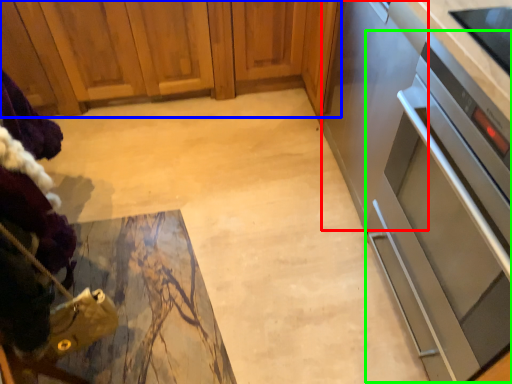
Question: Considering the real-world distances, which object is farthest from appliance (highlighted by a red box)? cabinetry (highlighted by a blue box) or oven (highlighted by a green box)?

Choices:
 (A) cabinetry
 (B) oven

Answer: (A)